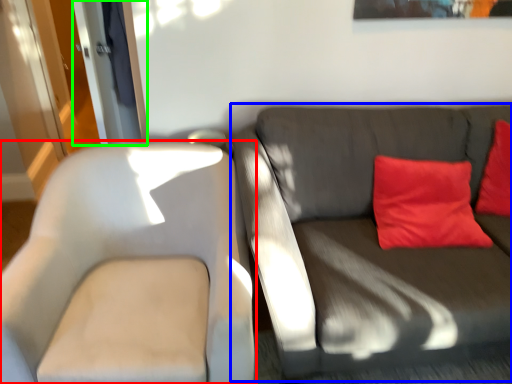
Question: Estimate the real-world distances between objects in this image. Which object is closer to chair (highlighted by a red box), studio couch (highlighted by a blue box) or glass door (highlighted by a green box)?

Choices:
 (A) studio couch
 (B) glass door

Answer: (A)